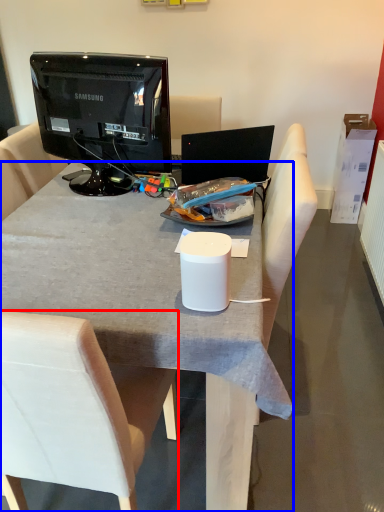
Question: Which object appears farthest to the camera in this image, chair (highlighted by a red box) or desk (highlighted by a blue box)?

Choices:
 (A) chair
 (B) desk

Answer: (B)